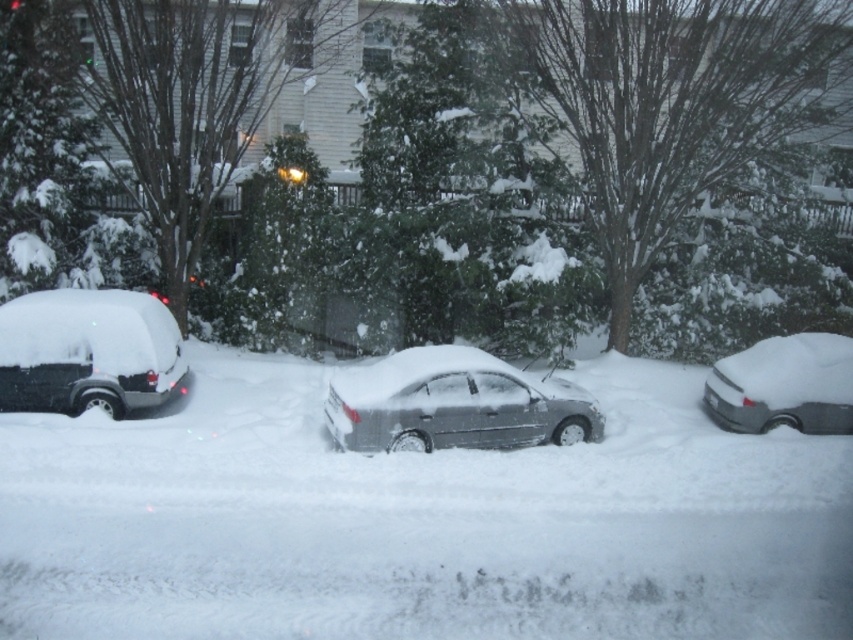
You are a delivery person trying to reach the sleek silver sedan at center. There is white fluffy snow at center blocking your path. Can you walk around the snow to reach the car?

The white fluffy snow at center is to the left of the sleek silver sedan at center, so you can walk around the snow on the right side to reach the car.

You are planning to park your car in this snowy area and need to know which vehicle takes up more space. Based on the image, which one is wider between the matte black van at left and the silver metallic sedan at right?

The matte black van at left might be wider than silver metallic sedan at right according to the description.

You are a snowplow driver needing to clear snow from the road. You see the sleek silver sedan at center and the silver metallic sedan at right. Which car should you avoid hitting because it is taller and might damage your plow?

The silver metallic sedan at right is taller than the sleek silver sedan at center, so you should avoid hitting the silver metallic sedan at right to prevent damage to your plow.